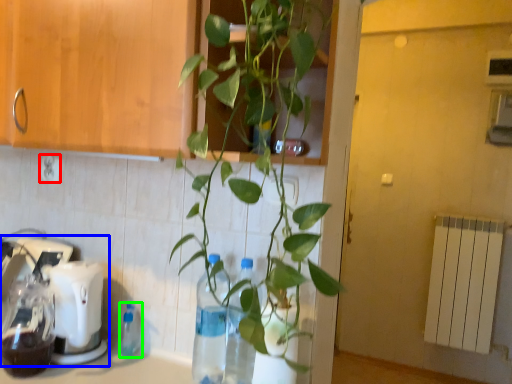
Question: Estimate the real-world distances between objects in this image. Which object is closer to electric outlet (highlighted by a red box), mixer (highlighted by a blue box) or bottle (highlighted by a green box)?

Choices:
 (A) mixer
 (B) bottle

Answer: (A)